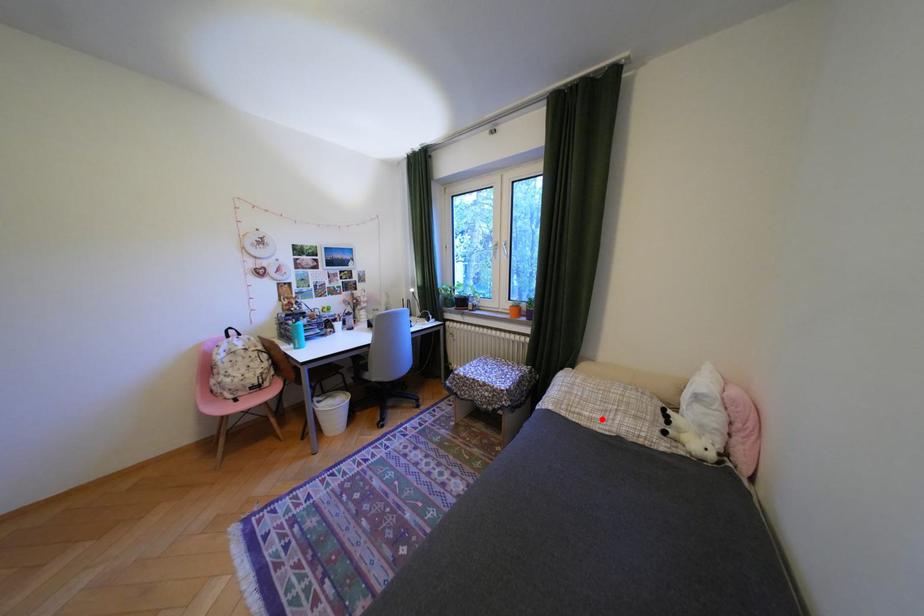
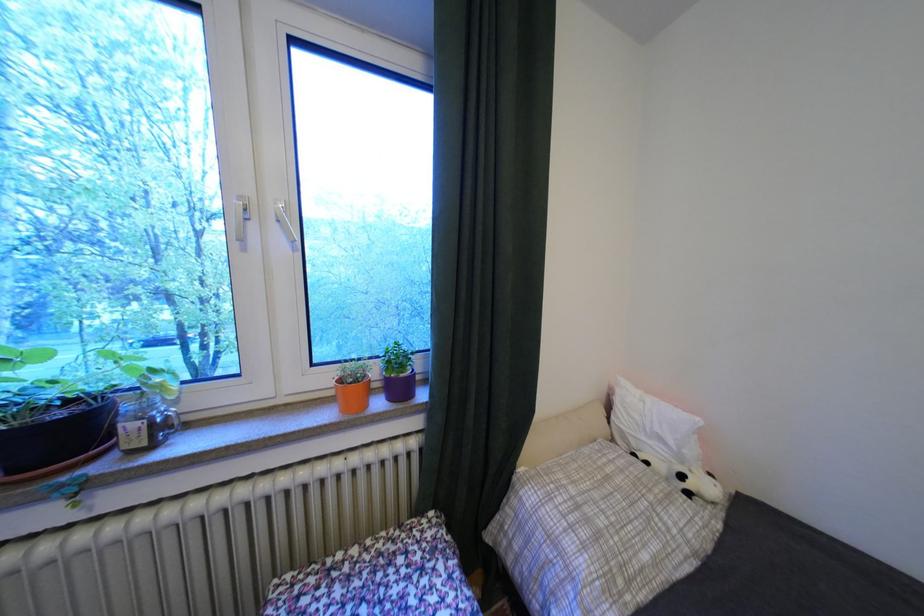
Question: I am providing you with two images of the same scene from different viewpoints. In image1, a red point is highlighted. Considering the same 3D point in image2, which of the following is correct?

Choices:
 (A) It is closer
 (B) It is farther

Answer: (A)